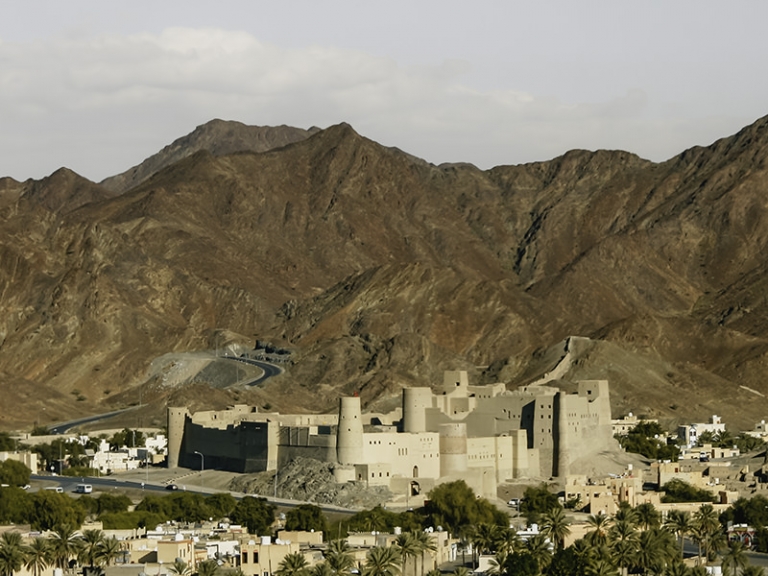
Locate an element on the screen. This screenshot has height=576, width=768. apartment windows is located at coordinates (240, 557), (260, 555).